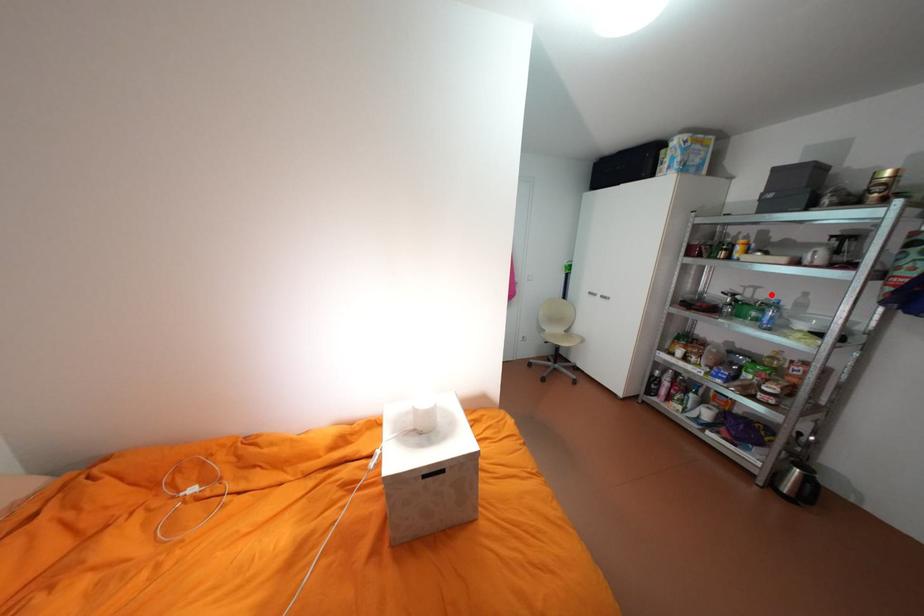
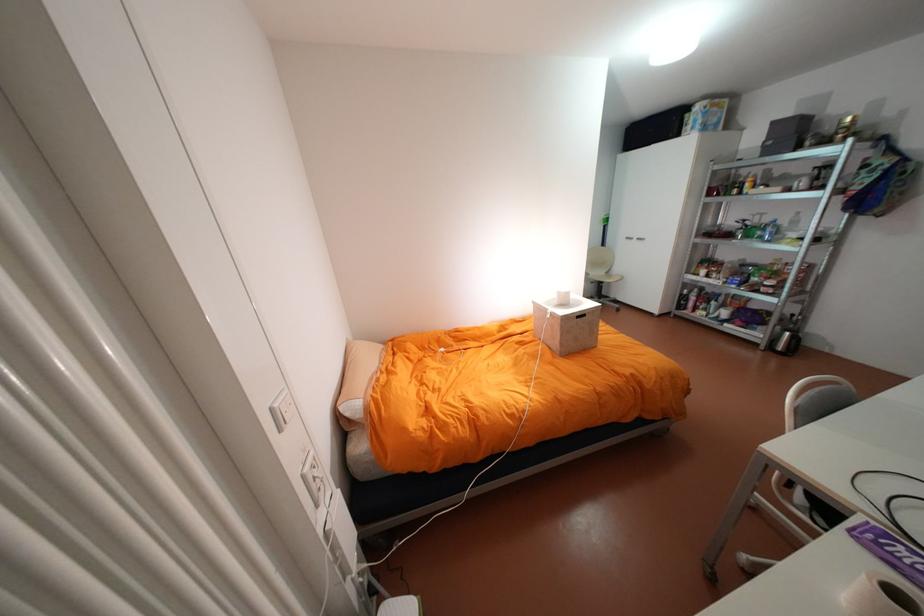
Find the pixel in the second image that matches the highlighted location in the first image.

(775, 219)